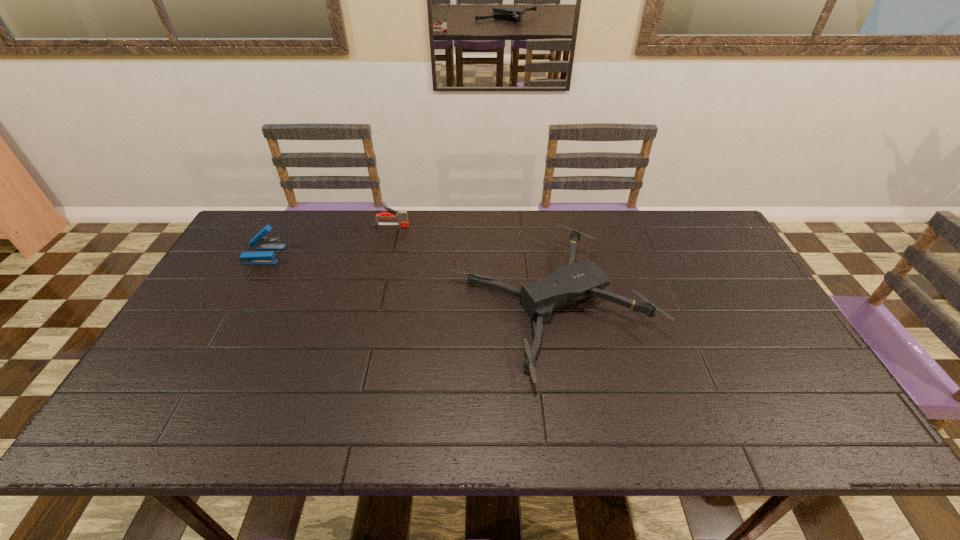
You are a GUI agent. You are given a task and a screenshot of the screen. Output one action in this format:
    pyautogui.click(x=<x>, y=<y>)
    Task: Click on the free point between the right stapler and the rightmost object
    The image size is (960, 540).
    Given the screenshot: What is the action you would take?
    pyautogui.click(x=471, y=266)

Where is `free point between the drone and the farther stapler`? Image resolution: width=960 pixels, height=540 pixels. free point between the drone and the farther stapler is located at coordinates (471, 266).

Identify the location of free space between the farthest object and the nearer stapler. (328, 240).

Identify the location of free space between the right stapler and the drone. The width and height of the screenshot is (960, 540). (471, 266).

The width and height of the screenshot is (960, 540). I want to click on vacant space that is in between the leftmost object and the rightmost object, so click(x=407, y=280).

At what (x,y) coordinates should I click in order to perform the action: click on free spot between the shorter stapler and the second object from right to left. Please return your answer as a coordinate pair (x, y). Looking at the image, I should click on (328, 240).

Where is `object that stands as the closest to the rightmost object`? This screenshot has width=960, height=540. object that stands as the closest to the rightmost object is located at coordinates (402, 216).

Identify which object is located as the nearest to the right stapler. Please provide its 2D coordinates. Your answer should be formatted as a tuple, i.e. [(x, y)], where the tuple contains the x and y coordinates of a point satisfying the conditions above.

[(576, 281)]

The height and width of the screenshot is (540, 960). In order to click on vacant position in the image that satisfies the following two spatial constraints: 1. on the handle side of the second object from right to left; 2. on the right side of the rightmost object in this screenshot , I will do `click(372, 306)`.

Identify the location of free space that satisfies the following two spatial constraints: 1. on the handle side of the farthest object; 2. on the back side of the rightmost object. (372, 306).